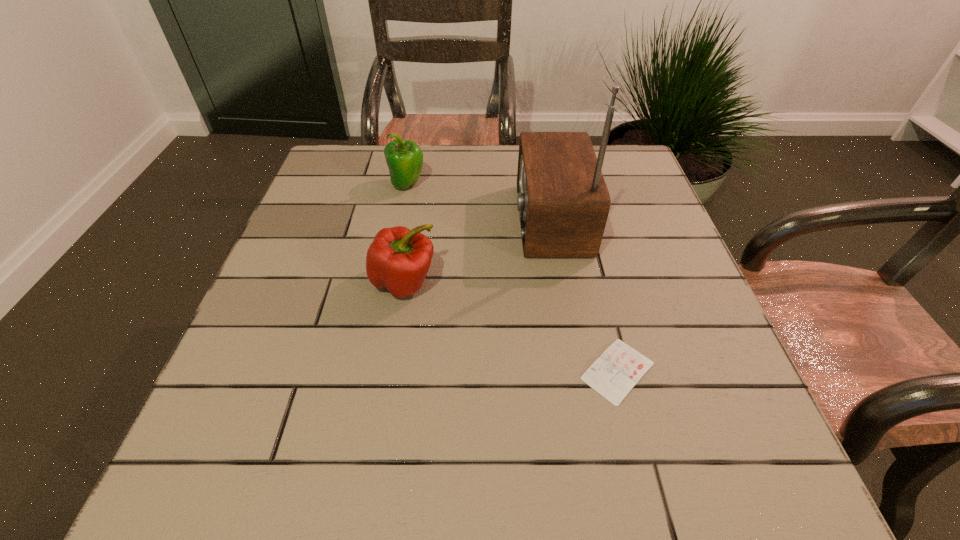
The image size is (960, 540). Identify the location of free point between the radio receiver and the diary. (584, 295).

The width and height of the screenshot is (960, 540). In order to click on the third closest object to the tallest object in this screenshot , I will do `click(404, 159)`.

Identify which object is the third closest to the nearest object. Please provide its 2D coordinates. Your answer should be formatted as a tuple, i.e. [(x, y)], where the tuple contains the x and y coordinates of a point satisfying the conditions above.

[(404, 159)]

Locate an element on the screen. This screenshot has width=960, height=540. vacant region that satisfies the following two spatial constraints: 1. on the front-facing side of the tallest object; 2. on the front side of the nearer bell pepper is located at coordinates (561, 282).

At what (x,y) coordinates should I click in order to perform the action: click on free location that satisfies the following two spatial constraints: 1. on the front-facing side of the tallest object; 2. on the left side of the shortest object. Please return your answer as a coordinate pair (x, y). The height and width of the screenshot is (540, 960). Looking at the image, I should click on (576, 371).

Where is `vacant space that satisfies the following two spatial constraints: 1. on the front-facing side of the tallest object; 2. on the right side of the shortest object`? Image resolution: width=960 pixels, height=540 pixels. vacant space that satisfies the following two spatial constraints: 1. on the front-facing side of the tallest object; 2. on the right side of the shortest object is located at coordinates (576, 371).